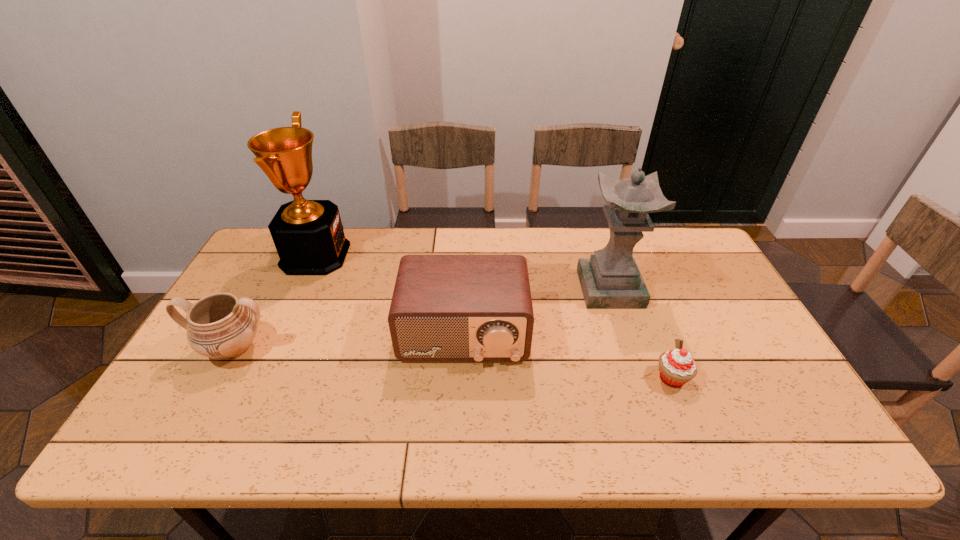
Locate an element on the screen. This screenshot has height=540, width=960. vacant space that satisfies the following two spatial constraints: 1. on the front of the trophy cup with the label; 2. on the front-facing side of the urn is located at coordinates (274, 348).

This screenshot has width=960, height=540. Find the location of `vacant space that satisfies the following two spatial constraints: 1. on the front panel of the radio receiver; 2. on the left side of the cupcake`. vacant space that satisfies the following two spatial constraints: 1. on the front panel of the radio receiver; 2. on the left side of the cupcake is located at coordinates (462, 378).

Identify the location of vacant point that satisfies the following two spatial constraints: 1. on the front of the trophy cup with the label; 2. on the front-facing side of the urn. (274, 348).